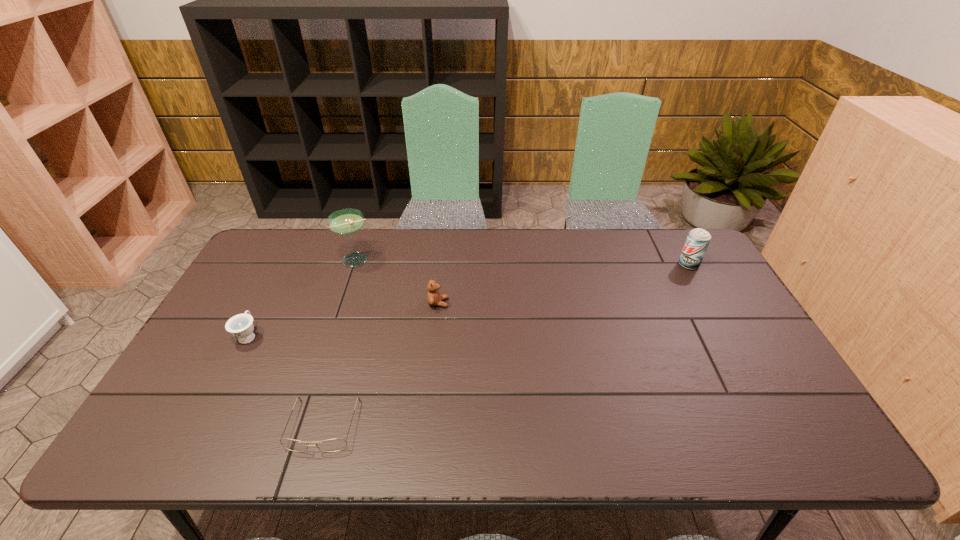
I want to click on free space located 0.360m on the left of the second tallest object, so click(570, 265).

Image resolution: width=960 pixels, height=540 pixels. In order to click on vacant space located on the face of the teddy bear in this screenshot , I will do click(x=521, y=303).

Locate an element on the screen. The height and width of the screenshot is (540, 960). free space located 0.250m on the side of the fourth tallest object with the handle is located at coordinates [x=284, y=267].

Locate an element on the screen. The height and width of the screenshot is (540, 960). vacant space located 0.310m on the side of the fourth tallest object with the handle is located at coordinates (290, 256).

Find the location of a particular element. The image size is (960, 540). vacant space located on the side of the fourth tallest object with the handle is located at coordinates (298, 242).

Where is `martini that is at the far edge`? The image size is (960, 540). martini that is at the far edge is located at coordinates (348, 221).

You are a GUI agent. You are given a task and a screenshot of the screen. Output one action in this format:
    pyautogui.click(x=<x>, y=<y>)
    Task: Click on the beer can at the far edge
    
    Given the screenshot: What is the action you would take?
    pyautogui.click(x=698, y=239)

Locate an element on the screen. The height and width of the screenshot is (540, 960). object that is positioned at the near edge is located at coordinates (331, 445).

Identify the location of object that is at the left edge. This screenshot has width=960, height=540. (241, 326).

The image size is (960, 540). I want to click on object that is at the right edge, so click(x=698, y=239).